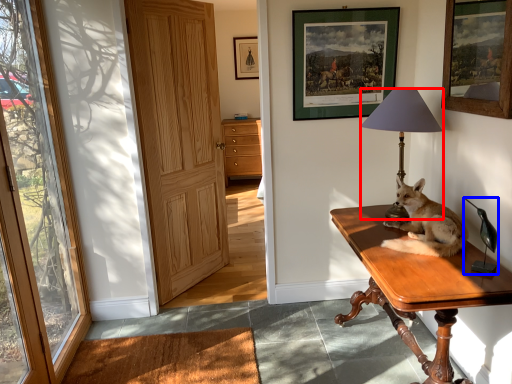
Question: Among these objects, which one is nearest to the camera, lamp (highlighted by a red box) or corded phone (highlighted by a blue box)?

Choices:
 (A) lamp
 (B) corded phone

Answer: (B)